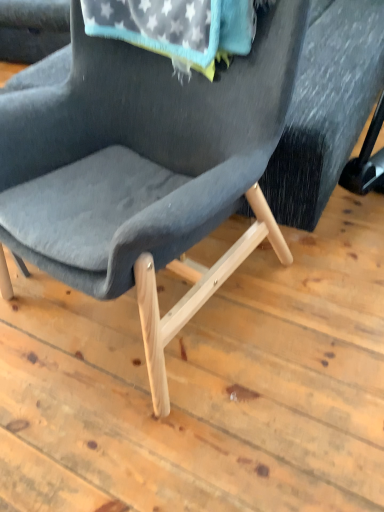
The height and width of the screenshot is (512, 384). Describe the element at coordinates (145, 168) in the screenshot. I see `natural wood chair at center` at that location.

Locate an element on the screen. natural wood chair at center is located at coordinates (145, 168).

Locate an element on the screen. The width and height of the screenshot is (384, 512). natural wood chair at center is located at coordinates (145, 168).